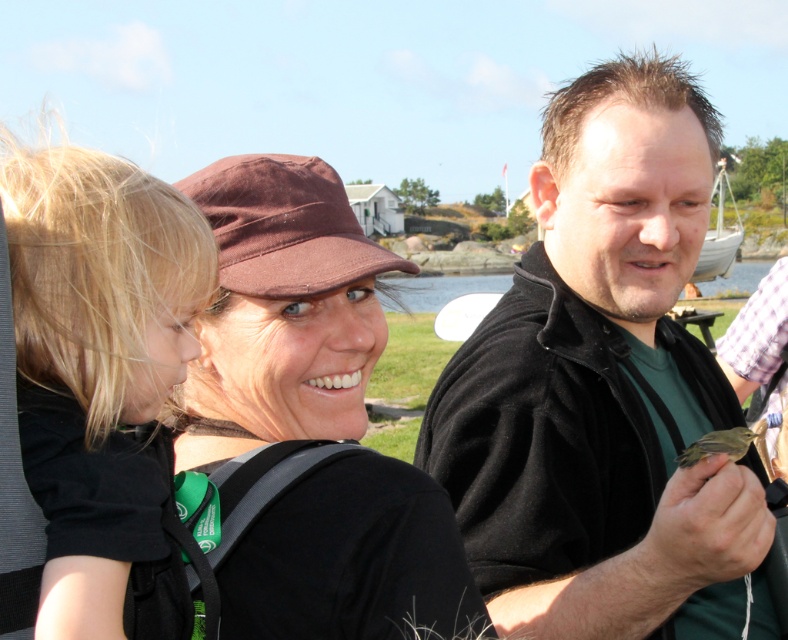
Question: Observing the image, what is the correct spatial positioning of blonde hair at left in reference to brown feathered bird at center?

Choices:
 (A) below
 (B) above

Answer: (B)

Question: Which point is farther to the camera?

Choices:
 (A) brown feathered bird at center
 (B) black softshell jacket at center
 (C) matte black shirt at center

Answer: (B)

Question: Can you confirm if matte black shirt at center is positioned to the right of brown feathered bird at center?

Choices:
 (A) yes
 (B) no

Answer: (B)

Question: Which object appears closest to the camera in this image?

Choices:
 (A) matte black shirt at center
 (B) brown feathered bird at center
 (C) black softshell jacket at center

Answer: (A)

Question: Where is matte black shirt at center located in relation to brown feathered bird at center in the image?

Choices:
 (A) left
 (B) right

Answer: (A)

Question: Which point appears farthest from the camera in this image?

Choices:
 (A) (28, 353)
 (B) (708, 442)
 (C) (227, 417)
 (D) (720, 506)

Answer: (C)